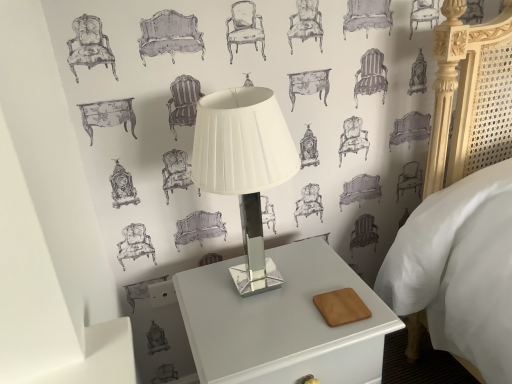
Question: From a real-world perspective, relative to white glossy nightstand at center, is white glossy table lamp at center vertically above or below?

Choices:
 (A) above
 (B) below

Answer: (A)

Question: Considering the positions of white glossy table lamp at center and white glossy nightstand at center in the image, is white glossy table lamp at center wider or thinner than white glossy nightstand at center?

Choices:
 (A) thin
 (B) wide

Answer: (A)

Question: Is white glossy table lamp at center spatially inside white glossy nightstand at center, or outside of it?

Choices:
 (A) outside
 (B) inside

Answer: (A)

Question: Is white glossy nightstand at center taller or shorter than white glossy table lamp at center?

Choices:
 (A) short
 (B) tall

Answer: (B)

Question: Is white glossy nightstand at center in front of or behind white glossy table lamp at center in the image?

Choices:
 (A) behind
 (B) front

Answer: (A)

Question: From a real-world perspective, is white glossy nightstand at center positioned above or below white glossy table lamp at center?

Choices:
 (A) below
 (B) above

Answer: (A)

Question: Looking at their shapes, would you say white glossy nightstand at center is wider or thinner than white glossy table lamp at center?

Choices:
 (A) wide
 (B) thin

Answer: (A)